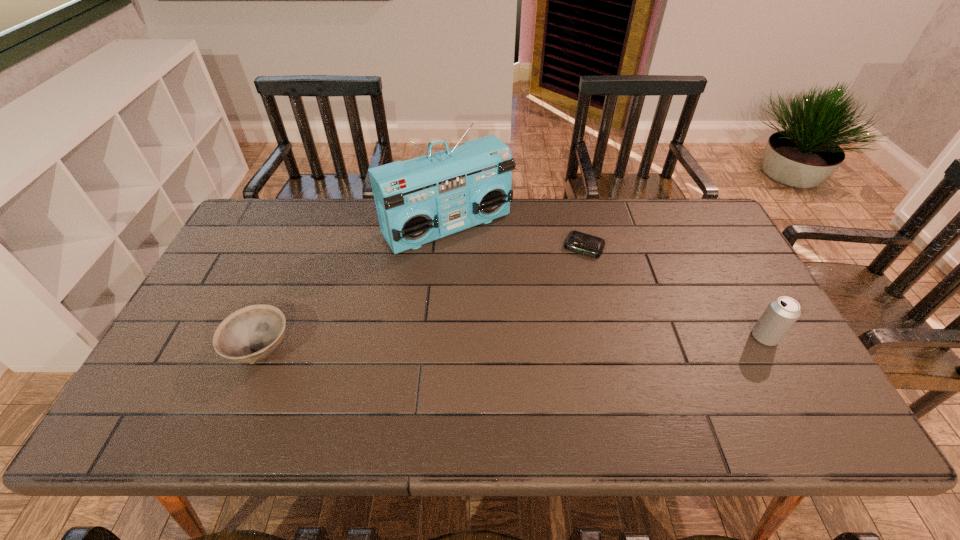
Locate an element on the screen. Image resolution: width=960 pixels, height=540 pixels. vacant space situated on the display of the alarm clock is located at coordinates (532, 356).

Where is `vacant region located on the display of the alarm clock`? vacant region located on the display of the alarm clock is located at coordinates (564, 286).

Where is `vacant space positioned 0.270m on the display of the alarm clock`? This screenshot has height=540, width=960. vacant space positioned 0.270m on the display of the alarm clock is located at coordinates (548, 321).

You are a GUI agent. You are given a task and a screenshot of the screen. Output one action in this format:
    pyautogui.click(x=<x>, y=<y>)
    Task: Click on the free space located 0.310m on the front-facing side of the radio receiver
    This screenshot has height=540, width=960.
    Given the screenshot: What is the action you would take?
    [x=538, y=328]

The height and width of the screenshot is (540, 960). I want to click on vacant point located on the front-facing side of the radio receiver, so pyautogui.click(x=511, y=295).

Image resolution: width=960 pixels, height=540 pixels. Find the location of `free space located on the front-facing side of the radio receiver`. free space located on the front-facing side of the radio receiver is located at coordinates (529, 317).

You are a GUI agent. You are given a task and a screenshot of the screen. Output one action in this format:
    pyautogui.click(x=<x>, y=<y>)
    Task: Click on the alarm clock positioned at the far edge
    This screenshot has width=960, height=540.
    Given the screenshot: What is the action you would take?
    pyautogui.click(x=578, y=242)

The height and width of the screenshot is (540, 960). In order to click on radio receiver that is at the far edge in this screenshot , I will do `click(423, 199)`.

The image size is (960, 540). What are the coordinates of `object that is positioned at the near edge` in the screenshot? It's located at (251, 334).

Find the location of `object at the left edge`. object at the left edge is located at coordinates (251, 334).